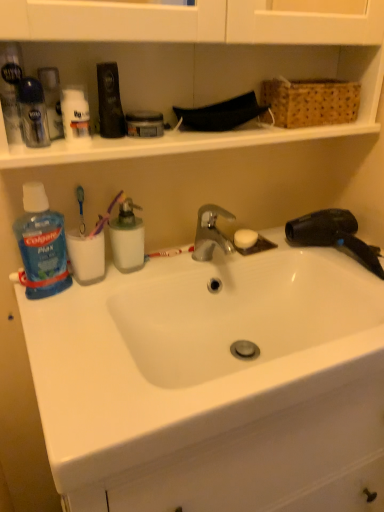
The image size is (384, 512). What are the coordinates of `vacant space to the right of white plastic toothbrush at center` in the screenshot? It's located at (245, 259).